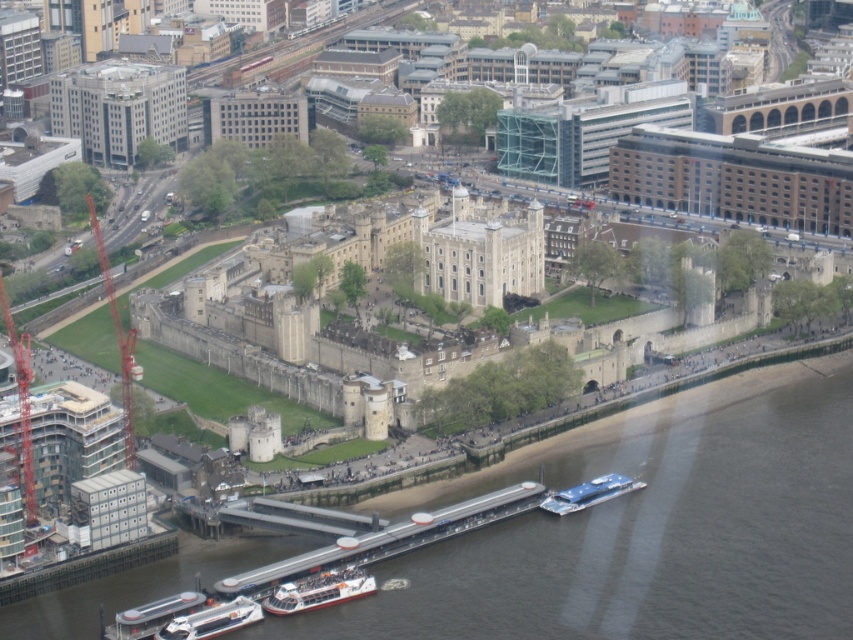
Does white glossy boat at lower left have a lesser width compared to white plastic boat at lower left?

No, white glossy boat at lower left is not thinner than white plastic boat at lower left.

Can you confirm if white glossy boat at lower left is shorter than white plastic boat at lower left?

Yes.

Between point (177, 628) and point (186, 602), which one is positioned in front?

Point (177, 628) is in front.

What are the coordinates of `white glossy boat at lower left` in the screenshot? It's located at (212, 620).

Does white glossy boat at lower center lie behind white glossy boat at lower left?

Yes.

Who is lower down, white glossy boat at lower center or white glossy boat at lower left?

Positioned lower is white glossy boat at lower left.

Identify the location of white glossy boat at lower center. (318, 589).

Where is `white glossy boat at lower center`? This screenshot has width=853, height=640. white glossy boat at lower center is located at coordinates (318, 589).

Who is positioned more to the left, gray concrete building at upper left or white glossy boat at lower left?

From the viewer's perspective, gray concrete building at upper left appears more on the left side.

Between point (56, 108) and point (165, 636), which one is positioned in front?

Positioned in front is point (165, 636).

Identify the location of gray concrete building at upper left. (119, 108).